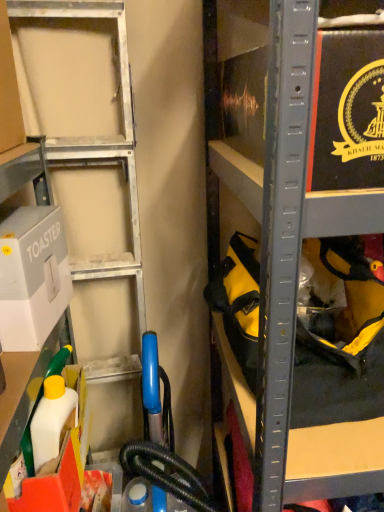
Question: Is white cardboard toaster at left, positioned as the 2th box in bottom-to-top order, wider or thinner than white plastic bottle at lower left, which is counted as the first box, starting from the bottom?

Choices:
 (A) thin
 (B) wide

Answer: (A)

Question: Do you think white cardboard toaster at left, positioned as the 2th box in bottom-to-top order, is within white plastic bottle at lower left, the second box positioned from the top, or outside of it?

Choices:
 (A) inside
 (B) outside

Answer: (B)

Question: In terms of height, does white cardboard toaster at left, positioned as the 2th box in bottom-to-top order, look taller or shorter compared to white plastic bottle at lower left, the second box positioned from the top?

Choices:
 (A) short
 (B) tall

Answer: (B)

Question: From their relative heights in the image, would you say white plastic bottle at lower left, which is counted as the first box, starting from the bottom, is taller or shorter than white cardboard toaster at left, positioned as the 2th box in bottom-to-top order?

Choices:
 (A) tall
 (B) short

Answer: (B)

Question: Based on their sizes in the image, would you say white plastic bottle at lower left, which is counted as the first box, starting from the bottom, is bigger or smaller than white cardboard toaster at left, positioned as the 2th box in bottom-to-top order?

Choices:
 (A) small
 (B) big

Answer: (B)

Question: From a real-world perspective, is white plastic bottle at lower left, the second box positioned from the top, above or below white cardboard toaster at left, placed as the 1th box when sorted from top to bottom?

Choices:
 (A) below
 (B) above

Answer: (A)

Question: Visually, is white plastic bottle at lower left, the second box positioned from the top, positioned to the left or to the right of white cardboard toaster at left, positioned as the 2th box in bottom-to-top order?

Choices:
 (A) right
 (B) left

Answer: (A)